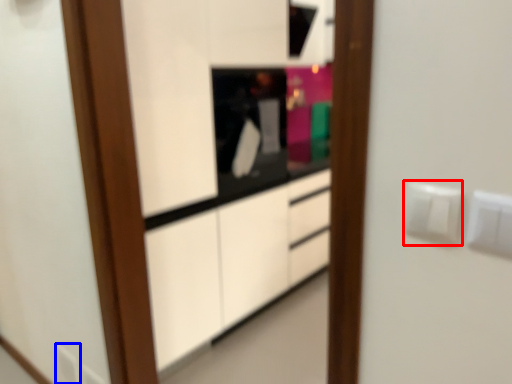
Question: Which object appears farthest to the camera in this image, electric outlet (highlighted by a red box) or electric outlet (highlighted by a blue box)?

Choices:
 (A) electric outlet
 (B) electric outlet

Answer: (B)